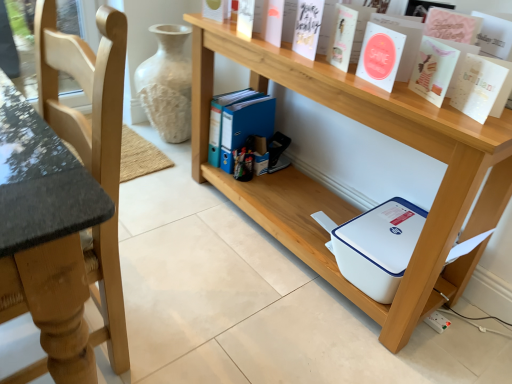
This screenshot has height=384, width=512. What are the coordinates of `free location in front of white paper at upper center, the 3th paperback book positioned from the right` in the screenshot? It's located at (417, 104).